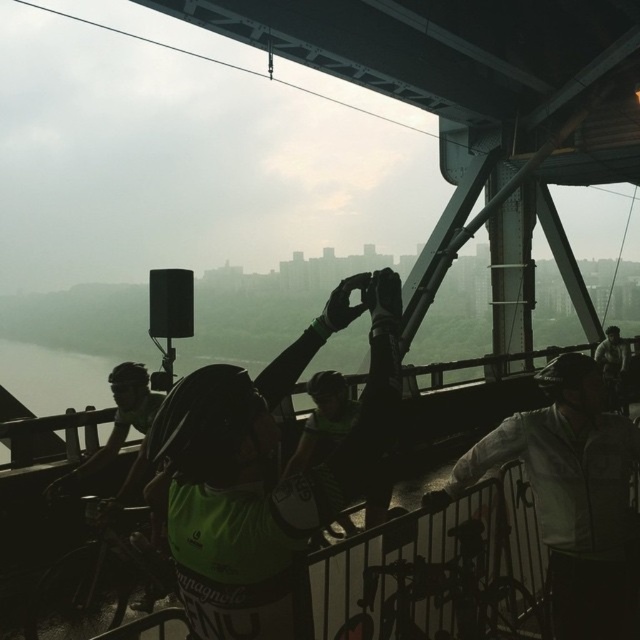
You are a photographer standing at the base of the bridge. You want to take a photo of the cyclists and the white matte jacket at center so that both are in focus. The depth of field in your camera can cover 3 meters. Will you be able to capture both subjects clearly?

The cyclists and the white matte jacket at center are 3.30 meters apart. Since the depth of field can only cover 3 meters, you won the

You are a photographer planning to capture the cyclists and the city view in one shot. Given that the white matte jacket at center and the transparent water at center are both in the frame, which object would appear smaller in your photo?

The white matte jacket at center would appear smaller in the photo since it has a smaller size compared to the transparent water at center according to the description.

You are a photographer aiming to capture a shot of the transparent water at center and the green reflective jersey at center. Which object appears taller in the photo?

The green reflective jersey at center is taller than the transparent water at center.